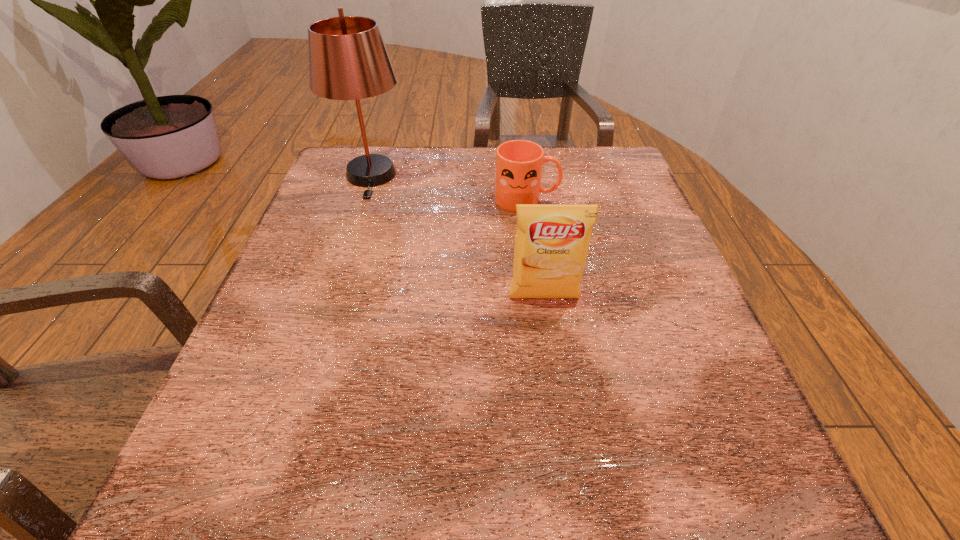
The width and height of the screenshot is (960, 540). What are the coordinates of `object that is at the left edge` in the screenshot? It's located at (348, 60).

This screenshot has height=540, width=960. I want to click on object that is at the far left corner, so click(348, 60).

In the image, there is a desktop. Identify the location of vacant space at the far edge. (393, 193).

In the image, there is a desktop. Identify the location of blank space at the near edge. The image size is (960, 540). (525, 484).

Where is `vacant space at the left edge of the desktop`? vacant space at the left edge of the desktop is located at coordinates (256, 420).

Where is `vacant space at the right edge`? The height and width of the screenshot is (540, 960). vacant space at the right edge is located at coordinates (687, 402).

Find the location of a particular element. The image size is (960, 540). free spot at the far left corner of the desktop is located at coordinates (358, 195).

Locate an element on the screen. vacant area at the far right corner is located at coordinates (601, 154).

In the image, there is a desktop. At what (x,y) coordinates should I click in order to perform the action: click on vacant space at the near right corner. Please return your answer as a coordinate pair (x, y). This screenshot has width=960, height=540. Looking at the image, I should click on (670, 497).

Identify the location of empty space between the crisp (potato chip) and the leftmost object. This screenshot has height=540, width=960. coord(457,237).